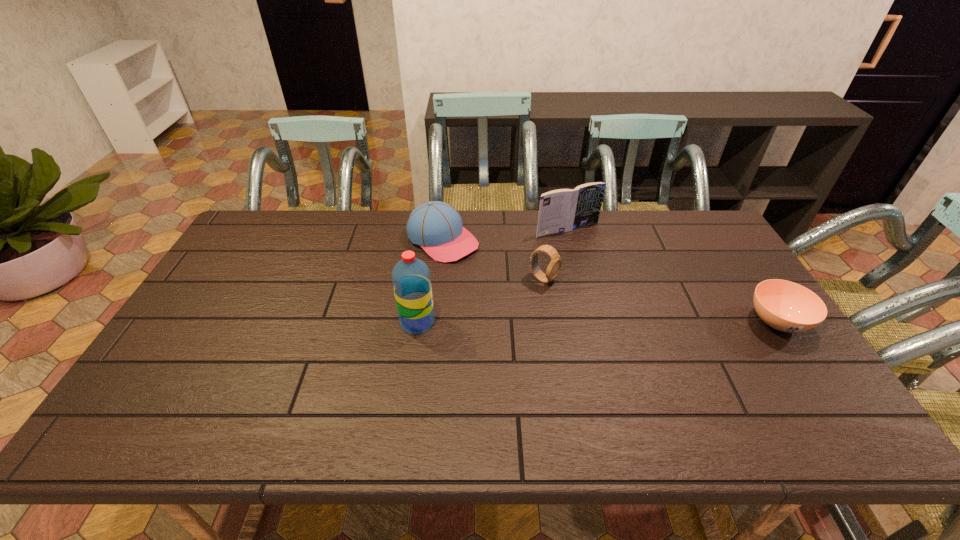
I want to click on free spot at the far edge of the desktop, so click(527, 234).

This screenshot has height=540, width=960. Find the location of `vacant space at the near edge of the desktop`. vacant space at the near edge of the desktop is located at coordinates (365, 382).

Identify the location of free space at the right edge. (726, 286).

In the image, there is a desktop. Where is `free space at the far left corner`? free space at the far left corner is located at coordinates (256, 211).

Identify the location of blank area at the near left corner. The image size is (960, 540). (189, 377).

You are a GUI agent. You are given a task and a screenshot of the screen. Output one action in this format:
    pyautogui.click(x=<x>, y=<y>)
    Task: Click on the vacant point at the far right corner
    This screenshot has height=540, width=960.
    Given the screenshot: What is the action you would take?
    pyautogui.click(x=696, y=247)

Where is `empty space between the fourth shortest object and the baseball cap`? empty space between the fourth shortest object and the baseball cap is located at coordinates (505, 235).

Find the location of a particular element. free space between the book and the soup bowl is located at coordinates (672, 276).

I want to click on blank region between the third farthest object and the rightmost object, so click(x=660, y=301).

Where is `vacant area that lies between the fourth shortest object and the rightmost object`? vacant area that lies between the fourth shortest object and the rightmost object is located at coordinates (672, 276).